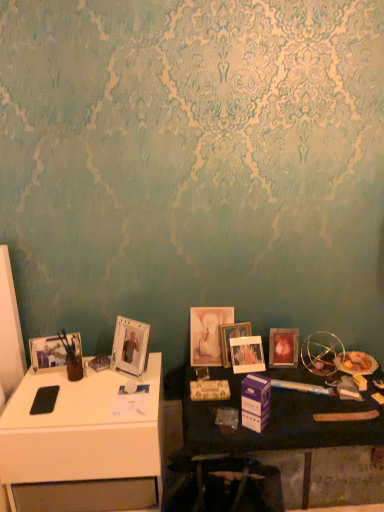
Question: Considering the relative sizes of matte glass picture frame at center right, which is the 1th picture frame in right-to-left order, and matte silver picture frame at left, marked as the 6th picture frame in a right-to-left arrangement, in the image provided, is matte glass picture frame at center right, which is the 1th picture frame in right-to-left order, thinner than matte silver picture frame at left, marked as the 6th picture frame in a right-to-left arrangement,?

Choices:
 (A) yes
 (B) no

Answer: (B)

Question: From the image's perspective, is matte glass picture frame at center right, the 6th picture frame in the left-to-right sequence, above matte silver picture frame at left, marked as the 6th picture frame in a right-to-left arrangement?

Choices:
 (A) yes
 (B) no

Answer: (B)

Question: Is matte glass picture frame at center right, which is the 1th picture frame in right-to-left order, aimed at matte silver picture frame at left, marked as the 6th picture frame in a right-to-left arrangement?

Choices:
 (A) no
 (B) yes

Answer: (A)

Question: Is matte glass picture frame at center right, the 6th picture frame in the left-to-right sequence, touching matte silver picture frame at left, acting as the first picture frame starting from the left?

Choices:
 (A) yes
 (B) no

Answer: (B)

Question: Can we say matte glass picture frame at center right, which is the 1th picture frame in right-to-left order, lies outside matte silver picture frame at left, marked as the 6th picture frame in a right-to-left arrangement?

Choices:
 (A) yes
 (B) no

Answer: (A)

Question: Can you confirm if matte glass picture frame at center right, the 6th picture frame in the left-to-right sequence, is smaller than matte silver picture frame at left, marked as the 6th picture frame in a right-to-left arrangement?

Choices:
 (A) no
 (B) yes

Answer: (A)

Question: Is wooden table at lower right far from matte silver picture frame at left, marked as the 6th picture frame in a right-to-left arrangement?

Choices:
 (A) no
 (B) yes

Answer: (A)

Question: Is wooden table at lower right wider than matte silver picture frame at left, marked as the 6th picture frame in a right-to-left arrangement?

Choices:
 (A) yes
 (B) no

Answer: (A)

Question: Does wooden table at lower right appear on the right side of matte silver picture frame at left, acting as the first picture frame starting from the left?

Choices:
 (A) yes
 (B) no

Answer: (A)

Question: Can you confirm if wooden table at lower right is smaller than matte silver picture frame at left, acting as the first picture frame starting from the left?

Choices:
 (A) yes
 (B) no

Answer: (B)

Question: From the image's perspective, is wooden table at lower right over matte silver picture frame at left, marked as the 6th picture frame in a right-to-left arrangement?

Choices:
 (A) no
 (B) yes

Answer: (A)

Question: Is wooden table at lower right outside of matte silver picture frame at left, acting as the first picture frame starting from the left?

Choices:
 (A) yes
 (B) no

Answer: (A)

Question: Would you say clear plastic picture frame at left, which appears as the second picture frame when viewed from the left, is part of matte silver picture frame at left, marked as the 6th picture frame in a right-to-left arrangement,'s contents?

Choices:
 (A) yes
 (B) no

Answer: (B)